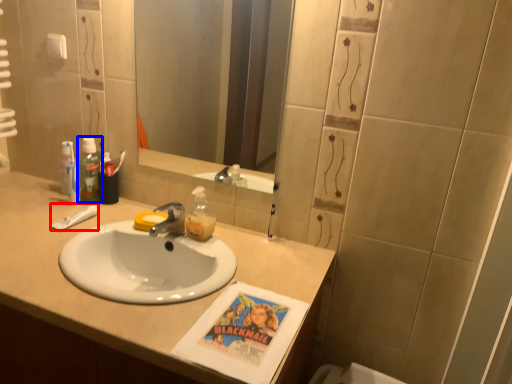
Question: Among these objects, which one is nearest to the camera, toothpaste (highlighted by a red box) or mouthwash (highlighted by a blue box)?

Choices:
 (A) toothpaste
 (B) mouthwash

Answer: (A)